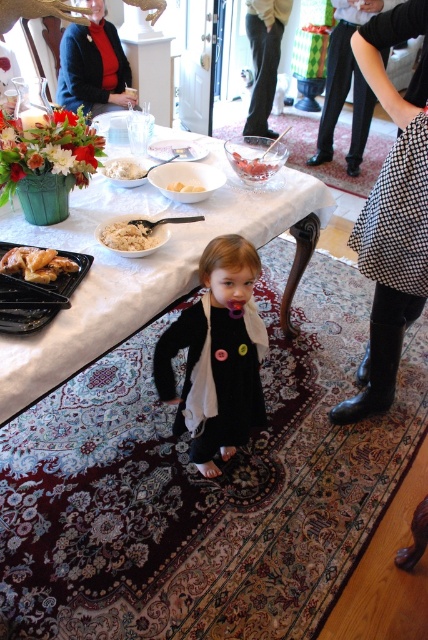
Question: Which is nearer to the golden crispy chicken at lower left?

Choices:
 (A) white fabric table at center
 (B) black plastic tray at lower left
 (C) matte black blazer at upper left
 (D) white creamy rice at center

Answer: (B)

Question: Based on their relative distances, which object is farther from the golden crispy chicken at lower left?

Choices:
 (A) white fabric table at center
 (B) black matte dress at center
 (C) white creamy rice at center

Answer: (C)

Question: Does black checkered dress at lower right appear on the left side of white creamy rice at center?

Choices:
 (A) yes
 (B) no

Answer: (B)

Question: Can you confirm if white rice at center is smaller than translucent glass bowl at center?

Choices:
 (A) no
 (B) yes

Answer: (B)

Question: Which point appears closest to the camera in this image?

Choices:
 (A) (26, 266)
 (B) (104, 173)
 (C) (68, 276)
 (D) (192, 189)

Answer: (A)

Question: Does white fabric table at center appear on the right side of golden crispy chicken at lower left?

Choices:
 (A) no
 (B) yes

Answer: (B)